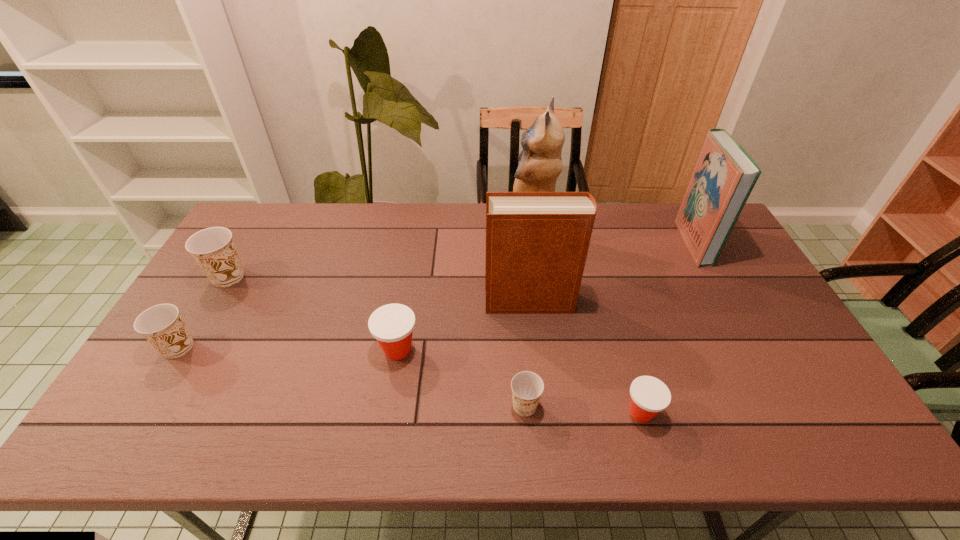
The width and height of the screenshot is (960, 540). In order to click on vacant space located 0.210m on the open cover of the nearer hardback book in this screenshot , I will do `click(415, 301)`.

Where is `vacant space located 0.070m on the open cover of the nearer hardback book`? The image size is (960, 540). vacant space located 0.070m on the open cover of the nearer hardback book is located at coordinates (462, 301).

The image size is (960, 540). I want to click on vacant space positioned on the front of the farthest Dixie cup, so click(211, 306).

Identify the location of vacant space situated 0.370m on the left of the third Dixie cup from right to left. (238, 350).

Where is `vacant space located 0.300m on the right of the second biggest orange Dixie cup`? Image resolution: width=960 pixels, height=540 pixels. vacant space located 0.300m on the right of the second biggest orange Dixie cup is located at coordinates (308, 347).

Find the location of a particular element. free location located on the right of the fourth Dixie cup from left to right is located at coordinates (685, 406).

Identify the location of free space located on the left of the rightmost Dixie cup. (471, 413).

Find the location of a particular element. cat that is at the far edge is located at coordinates (540, 165).

The width and height of the screenshot is (960, 540). Identify the location of hardback book that is at the far edge. (725, 174).

This screenshot has width=960, height=540. I want to click on object positioned at the right edge, so click(725, 174).